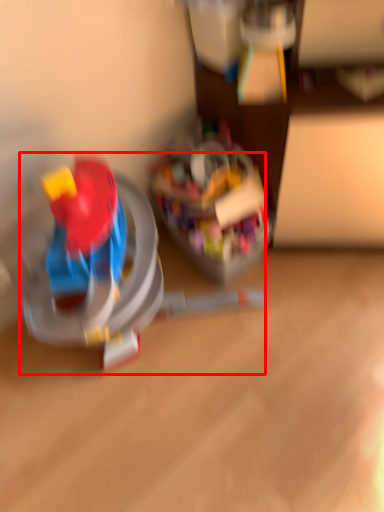
Question: In this image, where is toy (annotated by the red box) located relative to toy?

Choices:
 (A) right
 (B) left

Answer: (B)